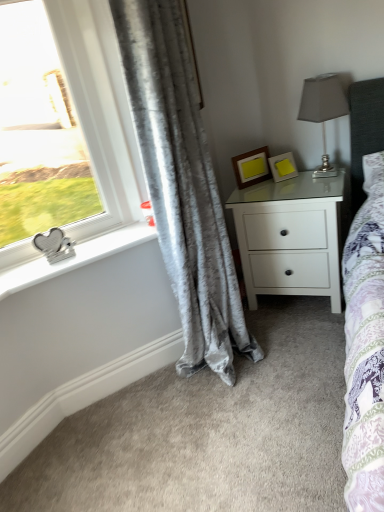
Locate an element on the screen. vacant area that lies to the right of wooden picture frame at center, which is counted as the second picture frame, starting from the right is located at coordinates (287, 179).